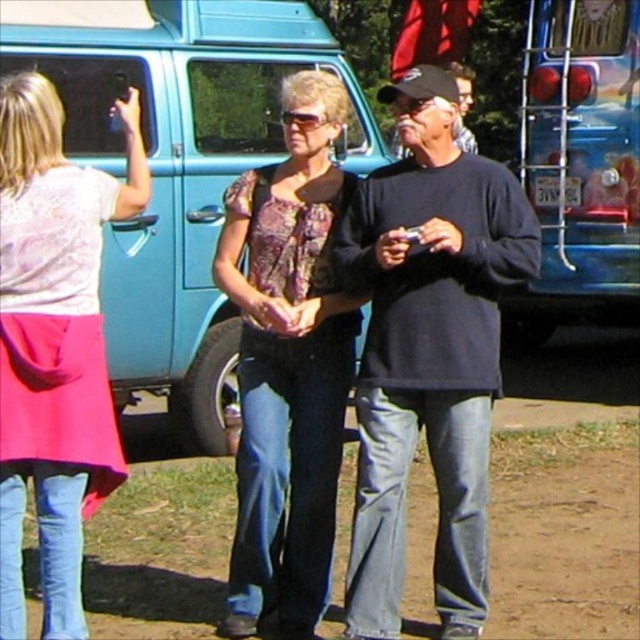
Is black cotton shirt at center positioned before matte floral blouse at center?

Yes, black cotton shirt at center is in front of matte floral blouse at center.

Is black cotton shirt at center positioned behind matte floral blouse at center?

No, it is in front of matte floral blouse at center.

Describe the element at coordinates (428, 352) in the screenshot. Image resolution: width=640 pixels, height=640 pixels. I see `black cotton shirt at center` at that location.

At what (x,y) coordinates should I click in order to perform the action: click on black cotton shirt at center. Please return your answer as a coordinate pair (x, y). The height and width of the screenshot is (640, 640). Looking at the image, I should click on (428, 352).

Does teal matte van at center have a lesser height compared to pink fabric skirt at left?

No, teal matte van at center is not shorter than pink fabric skirt at left.

Which is behind, point (76, 145) or point (97, 307)?

Point (76, 145)

This screenshot has width=640, height=640. Identify the location of teal matte van at center. (180, 168).

Does black cotton shirt at center have a lesser width compared to pink fabric skirt at left?

Incorrect, black cotton shirt at center's width is not less than pink fabric skirt at left's.

Is black cotton shirt at center bigger than pink fabric skirt at left?

Indeed, black cotton shirt at center has a larger size compared to pink fabric skirt at left.

Which is behind, point (388, 550) or point (12, 500)?

The point (388, 550) is behind.

You are a GUI agent. You are given a task and a screenshot of the screen. Output one action in this format:
    pyautogui.click(x=<x>, y=<y>)
    Task: Click on the black cotton shirt at center
    This screenshot has height=640, width=640.
    Given the screenshot: What is the action you would take?
    pyautogui.click(x=428, y=352)